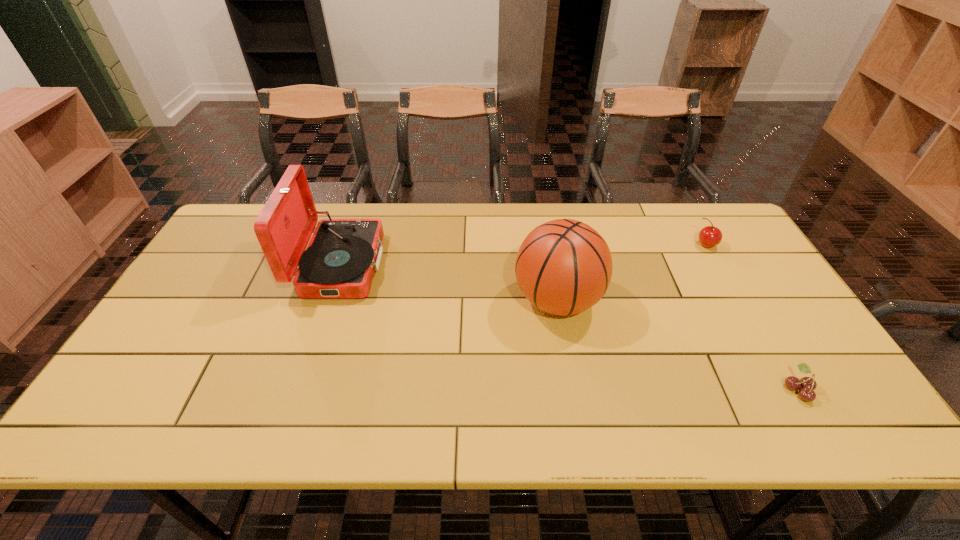
Image resolution: width=960 pixels, height=540 pixels. Identify the location of vacant position located on the leaves of the nearer cherry. (762, 389).

This screenshot has width=960, height=540. I want to click on free spot located 0.160m on the leaves of the nearer cherry, so click(x=714, y=389).

Find the location of a particular element. phonograph_record at the far edge is located at coordinates (343, 254).

Identify the location of cherry located at the far edge. This screenshot has width=960, height=540. (710, 236).

This screenshot has width=960, height=540. What are the coordinates of `object positioned at the near edge` in the screenshot? It's located at (808, 384).

Where is `object that is at the far right corner`? This screenshot has height=540, width=960. object that is at the far right corner is located at coordinates [x=710, y=236].

Where is `object that is positioned at the near right corner`? This screenshot has width=960, height=540. object that is positioned at the near right corner is located at coordinates (808, 384).

This screenshot has width=960, height=540. I want to click on vacant area at the far edge, so click(627, 248).

Where is `vacant space at the near edge`? The width and height of the screenshot is (960, 540). vacant space at the near edge is located at coordinates (290, 424).

This screenshot has height=540, width=960. I want to click on vacant space at the left edge of the desktop, so click(182, 392).